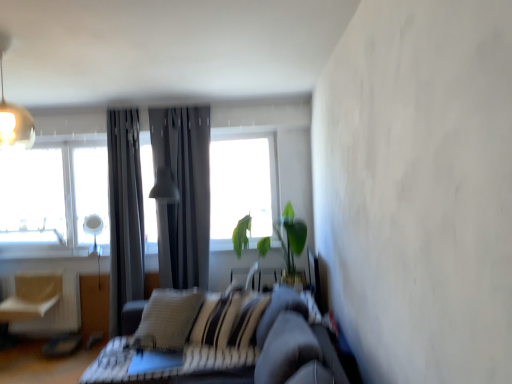
This screenshot has width=512, height=384. Describe the element at coordinates (31, 297) in the screenshot. I see `light beige fabric swivel chair at left` at that location.

Describe the element at coordinates (221, 344) in the screenshot. I see `dark gray leather couch at center` at that location.

Where is `dark gray leather couch at center`? This screenshot has width=512, height=384. dark gray leather couch at center is located at coordinates (221, 344).

At what (x,y) coordinates should I click in order to perform the action: click on transparent glass window at upper left. Please return your answer as a coordinate pair (x, y). This screenshot has height=384, width=512. Looking at the image, I should click on (56, 198).

This screenshot has height=384, width=512. I want to click on light beige fabric swivel chair at left, so click(31, 297).

Is dark gray fabric curtain at center facing towards dark gray leather couch at center?

Yes, dark gray fabric curtain at center is facing dark gray leather couch at center.

From the image's perspective, is dark gray fabric curtain at center above or below dark gray leather couch at center?

dark gray fabric curtain at center is situated higher than dark gray leather couch at center in the image.

Measure the distance between dark gray fabric curtain at center and dark gray leather couch at center.

They are 4.81 feet apart.

Does dark gray fabric curtain at center touch dark gray leather couch at center?

dark gray fabric curtain at center and dark gray leather couch at center are not in contact.

Which object is wider, light beige fabric swivel chair at left or transparent glass window at upper left?

transparent glass window at upper left is wider.

In terms of height, does light beige fabric swivel chair at left look taller or shorter compared to transparent glass window at upper left?

Clearly, light beige fabric swivel chair at left is shorter compared to transparent glass window at upper left.

Is light beige fabric swivel chair at left inside or outside of transparent glass window at upper left?

light beige fabric swivel chair at left is not inside transparent glass window at upper left, it's outside.

From a real-world perspective, which object rests below the other?

From a 3D spatial view, dark gray fabric curtain at center is below.

Which object is thinner, dark gray fabric curtain at center or metallic pendant light at upper left, the 2th light fixture in the bottom-to-top sequence?

dark gray fabric curtain at center is thinner.

Considering the positions of point (205, 219) and point (0, 57), is point (205, 219) closer or farther from the camera than point (0, 57)?

Point (205, 219) appears to be farther away from the viewer than point (0, 57).

Is dark gray fabric curtain at center looking in the opposite direction of metallic pendant light at upper left, which appears as the 1th light fixture when viewed from the front?

No, dark gray fabric curtain at center is not facing the opposite direction of metallic pendant light at upper left, which appears as the 1th light fixture when viewed from the front.

Would you say green leafy plant at center is part of light beige fabric swivel chair at left's contents?

That's incorrect, green leafy plant at center is not inside light beige fabric swivel chair at left.

Can you confirm if light beige fabric swivel chair at left is bigger than green leafy plant at center?

Incorrect, light beige fabric swivel chair at left is not larger than green leafy plant at center.

Is point (26, 281) farther from viewer compared to point (278, 227)?

No, it is in front of (278, 227).

From the image's perspective, which object appears higher, light beige fabric swivel chair at left or green leafy plant at center?

green leafy plant at center appears higher in the image.

Is green leafy plant at center positioned behind metallic pendant light at upper left, the second light fixture when ordered from back to front?

Yes, it is behind metallic pendant light at upper left, the second light fixture when ordered from back to front.

Is green leafy plant at center in contact with metallic pendant light at upper left, arranged as the first light fixture when viewed from the left?

No, green leafy plant at center is not with metallic pendant light at upper left, arranged as the first light fixture when viewed from the left.

Which is closer to the camera, (247, 241) or (2, 128)?

Clearly, point (247, 241) is more distant from the camera than point (2, 128).

Where is `houseplant lying in front of the light beige fabric swivel chair at left`? houseplant lying in front of the light beige fabric swivel chair at left is located at coordinates (291, 242).

From the image's perspective, is green leafy plant at center below light beige fabric swivel chair at left?

No, from the image's perspective, green leafy plant at center is not beneath light beige fabric swivel chair at left.

How much distance is there between green leafy plant at center and light beige fabric swivel chair at left?

green leafy plant at center and light beige fabric swivel chair at left are 2.36 meters apart.

From a real-world perspective, between green leafy plant at center and light beige fabric swivel chair at left, who is vertically lower?

light beige fabric swivel chair at left, from a real-world perspective.

Based on their positions, is dark gray leather couch at center located to the left or right of light beige fabric swivel chair at left?

Clearly, dark gray leather couch at center is on the right of light beige fabric swivel chair at left in the image.

From the picture: Is dark gray leather couch at center positioned beyond the bounds of light beige fabric swivel chair at left?

dark gray leather couch at center is positioned outside light beige fabric swivel chair at left.

Is dark gray leather couch at center positioned far away from light beige fabric swivel chair at left?

Indeed, dark gray leather couch at center is not near light beige fabric swivel chair at left.

I want to click on studio couch that appears on the right of dark gray fabric curtain at center, so click(x=221, y=344).

Identify the location of swivel chair in front of the transparent glass window at upper left. The image size is (512, 384). (31, 297).

From the image, which object appears to be nearer to matte gray lampshade at center, arranged as the 2th light fixture when viewed from the top, green leafy plant at center or light beige fabric swivel chair at left?

green leafy plant at center.

Based on their spatial positions, is dark gray leather couch at center or dark gray fabric curtain at center closer to matte gray lampshade at center, the 2th light fixture when ordered from left to right?

Among the two, dark gray fabric curtain at center is located nearer to matte gray lampshade at center, the 2th light fixture when ordered from left to right.

Which object lies further to the anchor point metallic pendant light at upper left, arranged as the first light fixture when viewed from the left, matte gray lampshade at center, arranged as the 2th light fixture when viewed from the top, or dark gray leather couch at center?

matte gray lampshade at center, arranged as the 2th light fixture when viewed from the top, is positioned further to the anchor metallic pendant light at upper left, arranged as the first light fixture when viewed from the left.

Estimate the real-world distances between objects in this image. Which object is closer to dark gray fabric curtain at center, metallic pendant light at upper left, the 2th light fixture in the bottom-to-top sequence, or transparent glass window at upper left?

transparent glass window at upper left is closer to dark gray fabric curtain at center.

Looking at the image, which one is located closer to transparent glass window at upper left, light beige fabric swivel chair at left or green leafy plant at center?

Based on the image, light beige fabric swivel chair at left appears to be nearer to transparent glass window at upper left.

From the picture: When comparing their distances from dark gray fabric curtain at center, does green leafy plant at center or dark gray leather couch at center seem further?

dark gray leather couch at center is positioned further to the anchor dark gray fabric curtain at center.

Based on their spatial positions, is matte gray lampshade at center, the 2th light fixture from the front, or green leafy plant at center further from dark gray fabric curtain at center?

Among the two, green leafy plant at center is located further to dark gray fabric curtain at center.

Which object lies nearer to the anchor point green leafy plant at center, metallic pendant light at upper left, which is counted as the 1th light fixture, starting from the top, or transparent glass window at upper left?

Based on the image, transparent glass window at upper left appears to be nearer to green leafy plant at center.

Locate an element on the screen. This screenshot has height=384, width=512. houseplant positioned between dark gray leather couch at center and matte gray lampshade at center, which is the 1th light fixture in back-to-front order, from near to far is located at coordinates (291, 242).

What are the coordinates of `light fixture between dark gray leather couch at center and dark gray fabric curtain at center along the z-axis` in the screenshot? It's located at (168, 214).

This screenshot has height=384, width=512. I want to click on houseplant between metallic pendant light at upper left, marked as the second light fixture in a right-to-left arrangement, and matte gray lampshade at center, which is the 1th light fixture in back-to-front order, in the front-back direction, so (291, 242).

Find the location of a particular element. The width and height of the screenshot is (512, 384). curtain between matte gray lampshade at center, the 2th light fixture from the front, and green leafy plant at center from left to right is located at coordinates (183, 194).